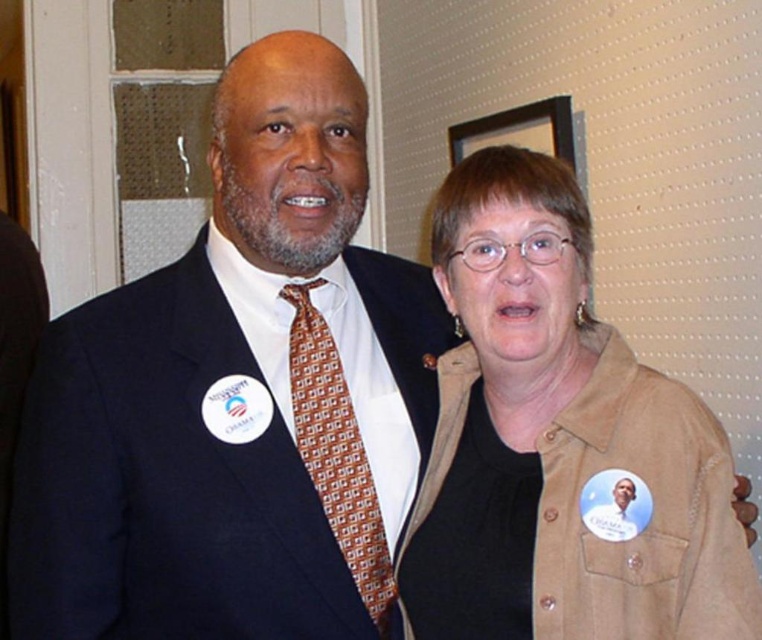
You are a photographer trying to capture a candid shot of the brown suede jacket at center without getting too close to the subject. If your camera has a maximum effective range of 3 feet, can you take the photo from your current position?

The brown suede jacket at center and camera are 3.42 feet apart from each other. Since the distance is slightly more than 3 feet, the camera may not effectively capture the photo from your current position.

You are a photographer at a political event. You want to take a photo that focuses on the brown silk tie at center without the brown suede jacket at center blocking it. Is this possible given their positions?

The brown suede jacket at center is closer to the viewer than the brown silk tie at center, so it will block the view of the brown silk tie at center. You need to move to a different angle to avoid the obstruction.

You are a photographer preparing to take a portrait of the two people in the image. You need to ensure that both the brown suede jacket at center and the brown silk tie at center are clearly visible in the photo. Based on their sizes, which object will require you to focus more on its vertical placement?

The brown suede jacket at center has a greater height compared to the brown silk tie at center, so you will need to focus more on the vertical placement of the brown suede jacket at center to ensure it is fully visible in the photo.